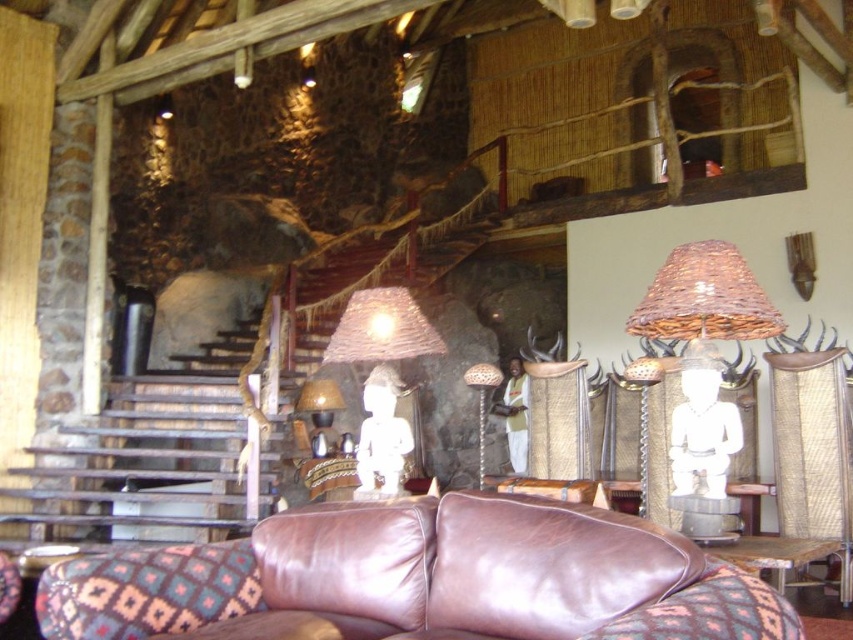
In the scene shown: Can you confirm if brown leather couch at lower center is positioned below matte wicker lampshade at center?

No, brown leather couch at lower center is not below matte wicker lampshade at center.

In the scene shown: Does brown leather couch at lower center appear over matte wicker lampshade at center?

Yes.

Is point (119, 602) closer to camera compared to point (316, 410)?

Yes, point (119, 602) is closer to viewer.

Find the location of `brown leather couch at lower center`. brown leather couch at lower center is located at coordinates (421, 579).

Does brown leather couch at lower center have a smaller size compared to woven straw lampshade at center?

Incorrect, brown leather couch at lower center is not smaller in size than woven straw lampshade at center.

Which is more to the left, brown leather couch at lower center or woven straw lampshade at center?

woven straw lampshade at center

What do you see at coordinates (421, 579) in the screenshot? The width and height of the screenshot is (853, 640). I see `brown leather couch at lower center` at bounding box center [421, 579].

Identify the location of brown leather couch at lower center. (421, 579).

Between point (401, 330) and point (300, 396), which one is positioned in front?

Positioned in front is point (401, 330).

Which is above, woven straw lampshade at center or matte wicker lampshade at center?

woven straw lampshade at center is above.

Between point (396, 312) and point (325, 392), which one is positioned in front?

Point (396, 312)

Image resolution: width=853 pixels, height=640 pixels. In order to click on woven straw lampshade at center in this screenshot , I will do tap(381, 328).